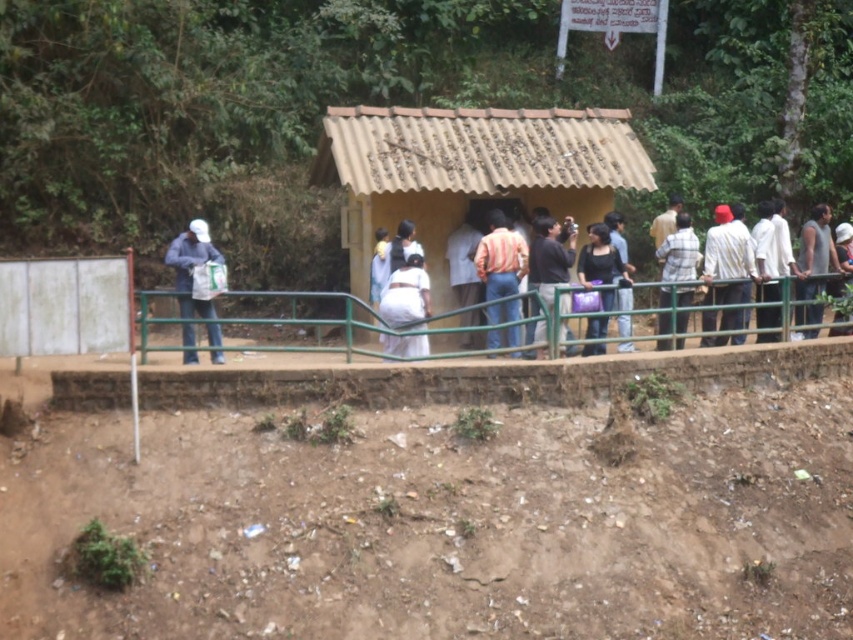
You are a photographer trying to capture a wide shot of the brown corrugated roof hut at center and the dark brown hair at right. Since you want both subjects to be clearly visible in the frame, which one should you focus on first to ensure proper depth of field?

The brown corrugated roof hut at center should be focused on first because it is larger in size compared to the dark brown hair at right, ensuring both will be in focus when using depth of field techniques.

You are standing at the edge of the shelter and want to reach the striped cotton shirt at center. Which direction should you move relative to the green metal railing at center?

The green metal railing at center is to the left of the striped cotton shirt at center, so you should move to the right relative to the green metal railing at center to reach the striped cotton shirt at center.

You are a delivery person trying to park your 1.2 meter wide delivery cart between the brown corrugated roof hut at center and the dark brown hair at right. Can you fit your cart there?

The brown corrugated roof hut at center might be wider than dark brown hair at right, so there might not be enough space to fit the 1.2 meter wide delivery cart between them.